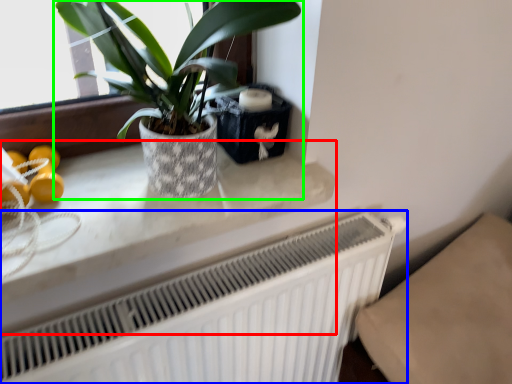
Question: Which object is the farthest from counter top (highlighted by a red box)? Choose among these: radiator (highlighted by a blue box) or houseplant (highlighted by a green box).

Choices:
 (A) radiator
 (B) houseplant

Answer: (B)